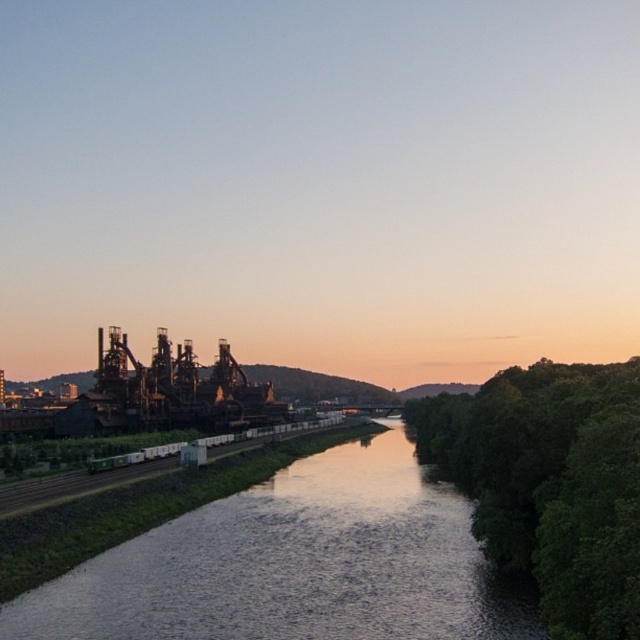
You are standing at the edge of the river and want to walk towards the green leafy trees at right. Which direction should you move relative to the dark reflective water at center?

You should move away from the dark reflective water at center because it is closer to you than the green leafy trees at right, so moving away from it will bring you closer to the trees.

You are standing at the point marked as point (353, 586) and want to walk towards the point marked as point (557, 429). Given that you can only move along the riverbank, which direction should you head? The river flows from the upper left to the lower right of the image.

Since point (353, 586) is closer to the camera than point (557, 429), you should head upstream against the river flow towards the upper left direction to reach the destination.